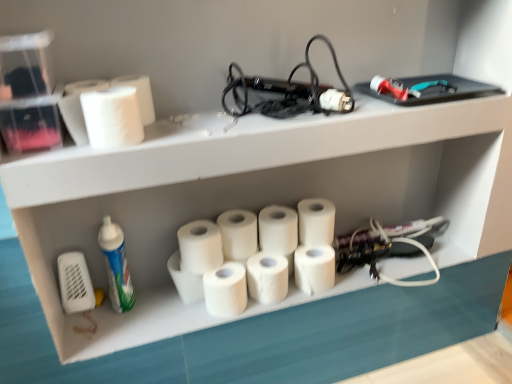
Locate an element on the screen. This screenshot has height=384, width=512. free spot in front of blue-green plastic cleaning product at lower left is located at coordinates (106, 335).